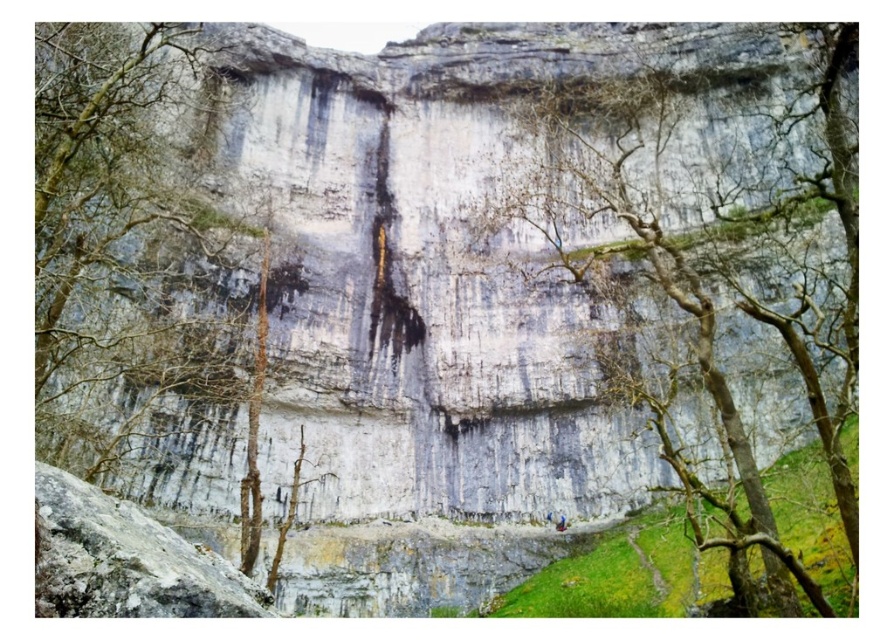
Based on the photo, is bare branches at center bigger than green leafy tree at center?

Correct, bare branches at center is larger in size than green leafy tree at center.

Based on the photo, can you confirm if bare branches at center is shorter than green leafy tree at center?

No, bare branches at center is not shorter than green leafy tree at center.

Is point (673, 173) positioned behind point (190, 122)?

Yes, point (673, 173) is farther from viewer.

Locate an element on the screen. The height and width of the screenshot is (640, 894). bare branches at center is located at coordinates (707, 241).

Can you confirm if bare branches at center is thinner than gray rough rock at lower left?

In fact, bare branches at center might be wider than gray rough rock at lower left.

Who is shorter, bare branches at center or gray rough rock at lower left?

gray rough rock at lower left is shorter.

Is point (520, 220) less distant than point (86, 524)?

No, it is not.

The image size is (894, 640). I want to click on bare branches at center, so click(x=707, y=241).

Which is behind, point (62, 497) or point (559, 515)?

The point (559, 515) is behind.

Find the location of a particular element. The image size is (894, 640). gray rough rock at lower left is located at coordinates (125, 561).

Is point (187, 573) closer to viewer compared to point (555, 529)?

Yes, it is in front of point (555, 529).

Where is `gray rough rock at lower left`? This screenshot has width=894, height=640. gray rough rock at lower left is located at coordinates (125, 561).